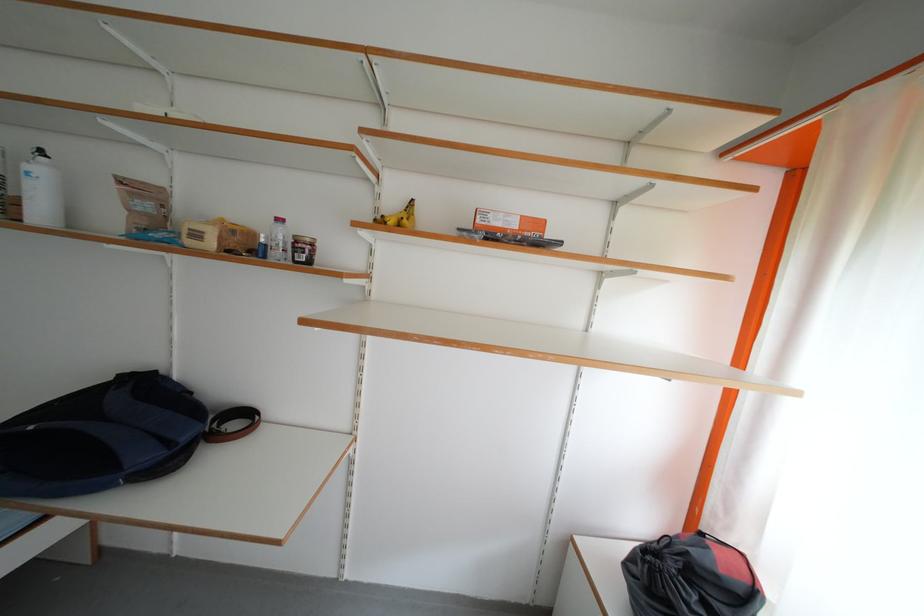
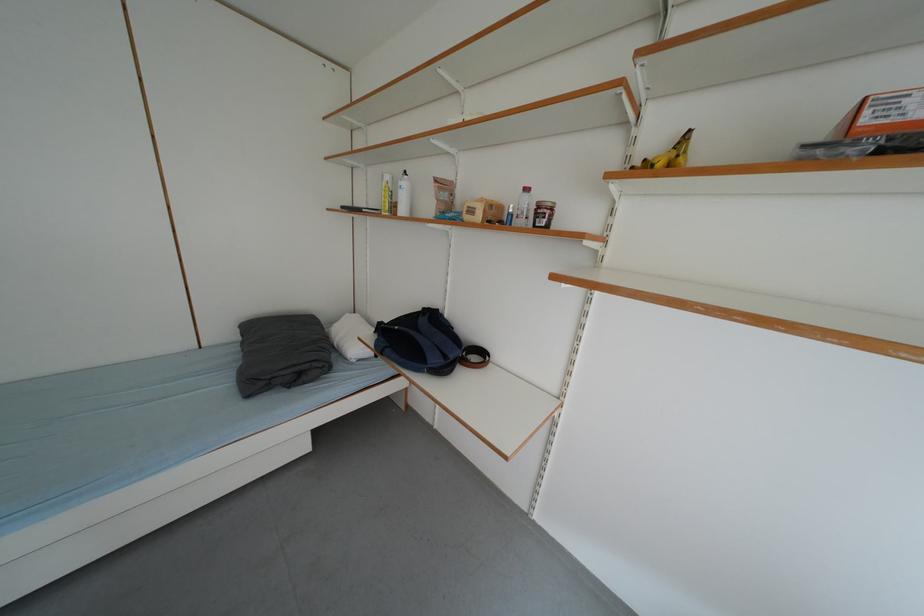
Locate, in the second image, the point that corresponds to [193,442] in the first image.

(460, 360)